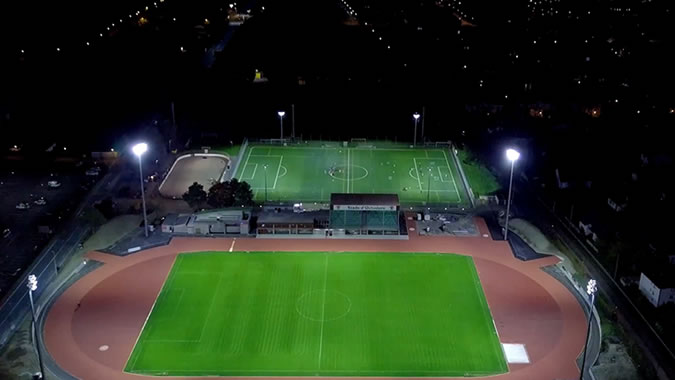
The image size is (675, 380). I want to click on lighted area, so click(x=246, y=75).